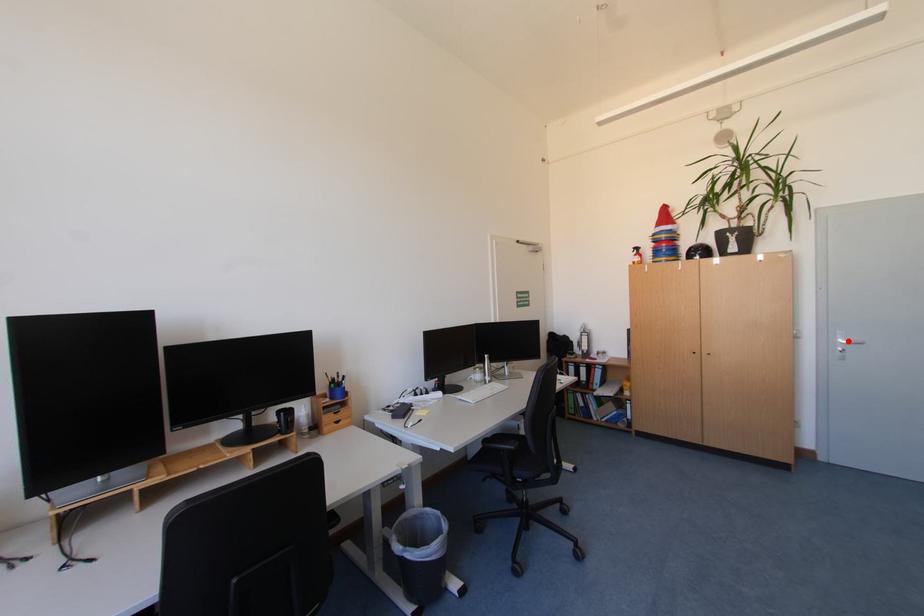
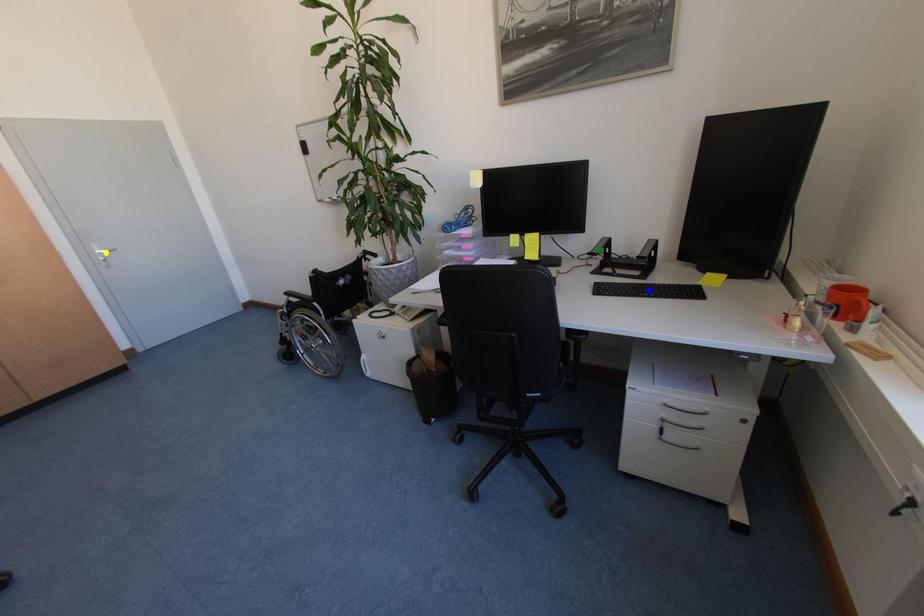
Question: I am providing you with two images of the same scene from different viewpoints. A red point is marked on the first image. You are given multiple points on the second image. Which spot in image 2 lines up with the point in image 1?

Choices:
 (A) blue point
 (B) green point
 (C) yellow point

Answer: (C)